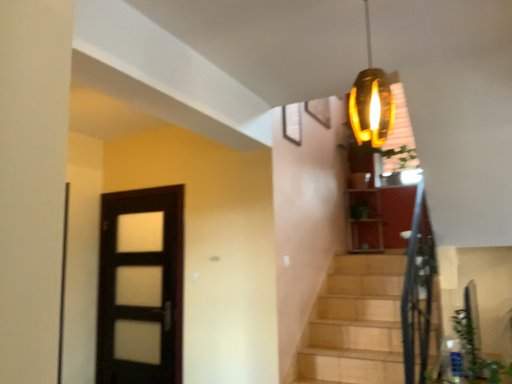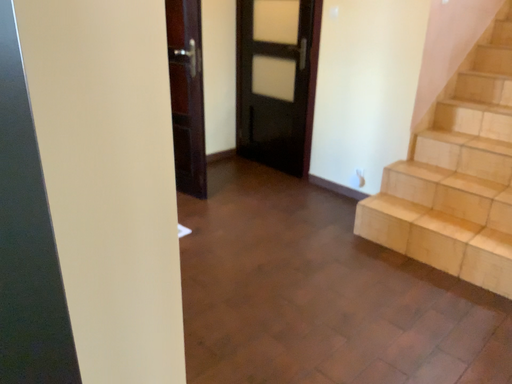
Question: Which way did the camera rotate in the video?

Choices:
 (A) rotated right
 (B) rotated left

Answer: (B)